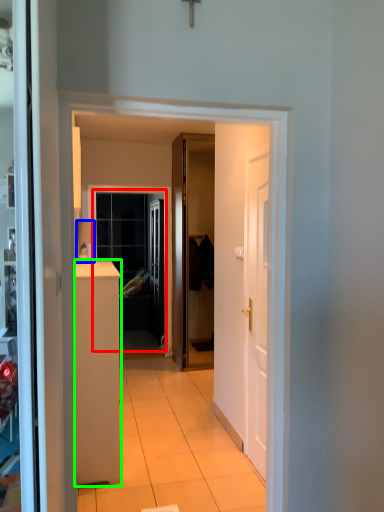
Question: Which is nearer to the window (highlighted by a red box)? lamp (highlighted by a blue box) or cabinetry (highlighted by a green box).

Choices:
 (A) lamp
 (B) cabinetry

Answer: (A)